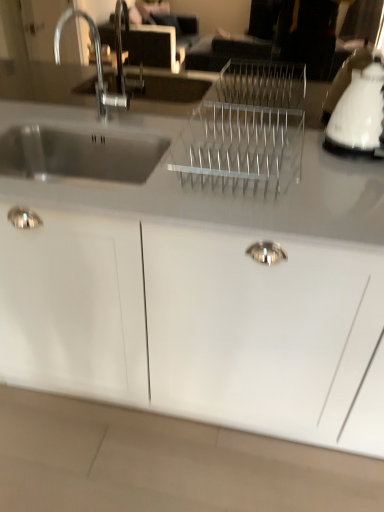
This screenshot has height=512, width=384. I want to click on free spot below white glossy kettle at upper right (from a real-world perspective), so click(x=354, y=155).